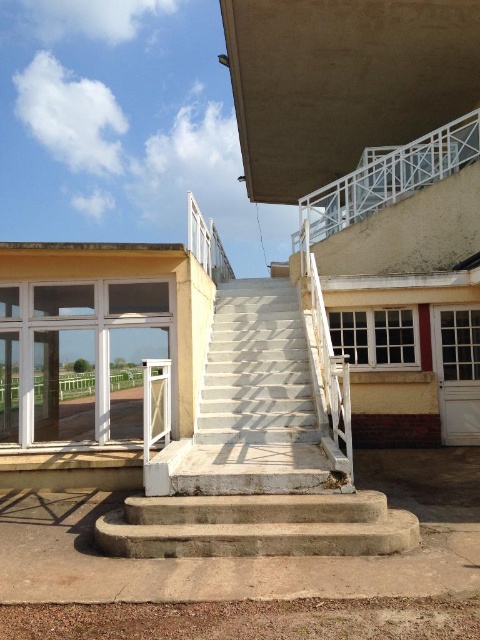
Where are the white concrete stairs at center located in the image?

The white concrete stairs at center are located at point (255, 404) in the image.

You are standing at the base of the staircase and want to move towards the platform. There are two points marked on the staircase, point A at coordinates point (257,454) and point B at coordinates point (156,513). Which point would you reach first as you climb the staircase?

Point A at coordinates point (257,454) is further to the viewer than point B at coordinates point (156,513). Therefore, you would reach point A first as you climb the staircase.